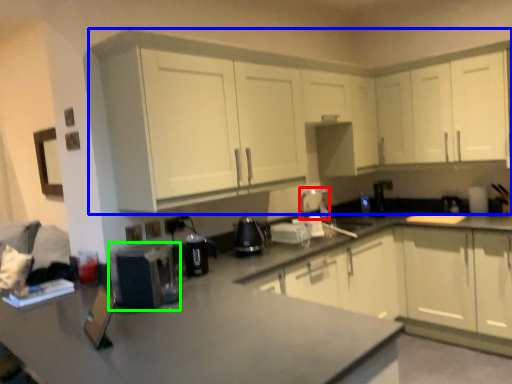
Question: Which object is positioned farthest from appliance (highlighted by a red box)? Select from cabinetry (highlighted by a blue box) and appliance (highlighted by a green box).

Choices:
 (A) cabinetry
 (B) appliance

Answer: (B)